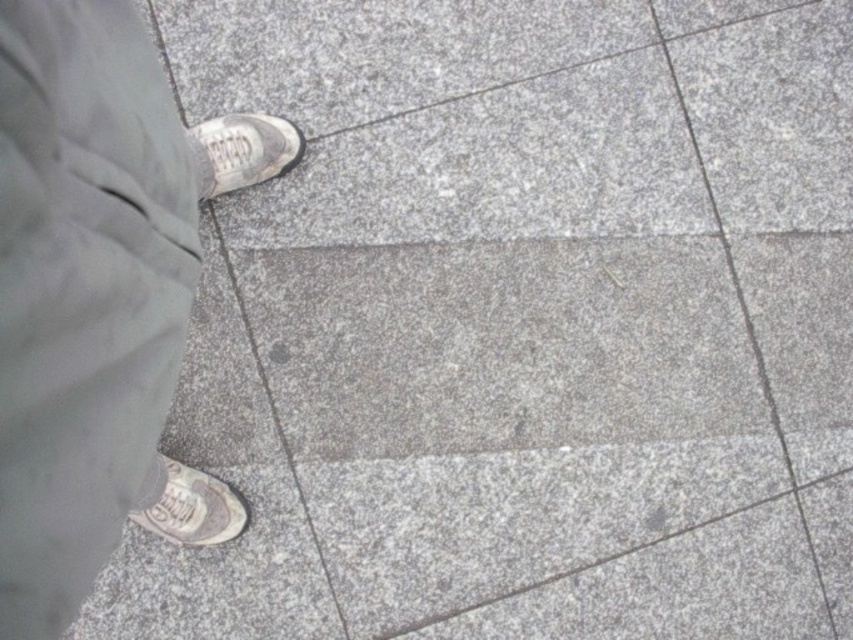
Does matte gray pants at lower left have a lesser width compared to white canvas shoe at upper left?

Indeed, matte gray pants at lower left has a lesser width compared to white canvas shoe at upper left.

Does matte gray pants at lower left appear on the left side of white canvas shoe at upper left?

No, matte gray pants at lower left is not to the left of white canvas shoe at upper left.

Who is more forward, [4,371] or [192,129]?

Point [4,371] is in front.

Where is `matte gray pants at lower left`? Image resolution: width=853 pixels, height=640 pixels. matte gray pants at lower left is located at coordinates pyautogui.click(x=99, y=296).

Does white canvas shoe at upper left have a greater width compared to white leather shoe at lower left?

No, white canvas shoe at upper left is not wider than white leather shoe at lower left.

Who is higher up, white canvas shoe at upper left or white leather shoe at lower left?

white canvas shoe at upper left is above.

Describe the element at coordinates (242, 150) in the screenshot. I see `white canvas shoe at upper left` at that location.

Locate an element on the screen. This screenshot has height=640, width=853. white canvas shoe at upper left is located at coordinates (242, 150).

Is point (173, 481) farther from viewer compared to point (161, 460)?

Yes, it is.

Where is `matte gray pants at lower left`? The image size is (853, 640). matte gray pants at lower left is located at coordinates (99, 296).

The image size is (853, 640). Identify the location of matte gray pants at lower left. (99, 296).